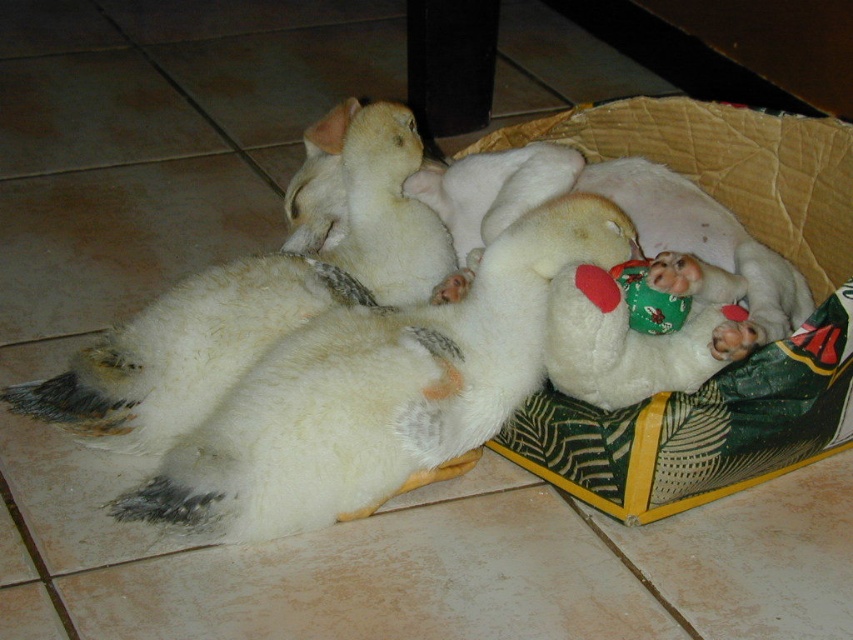
You are trying to place a new toy into the cardboard basket at center. The toy is as wide as the white fluffy dog at center. Will the toy fit inside the basket?

The white fluffy dog at center is wider than the cardboard basket at center, so the toy, being as wide as the dog, would not fit inside the basket.

You are a photographer standing 3 feet away from the white fluffy dog at center. You want to take a photo of it without moving. Can you reach it with your camera lens? Assume your camera has a standard zoom lens that can focus as close as 2 feet.

The white fluffy dog at center is 3.29 feet away from the camera. Since your camera can focus as close as 2 feet, you can reach the white fluffy dog at center because the distance is within the lens range.